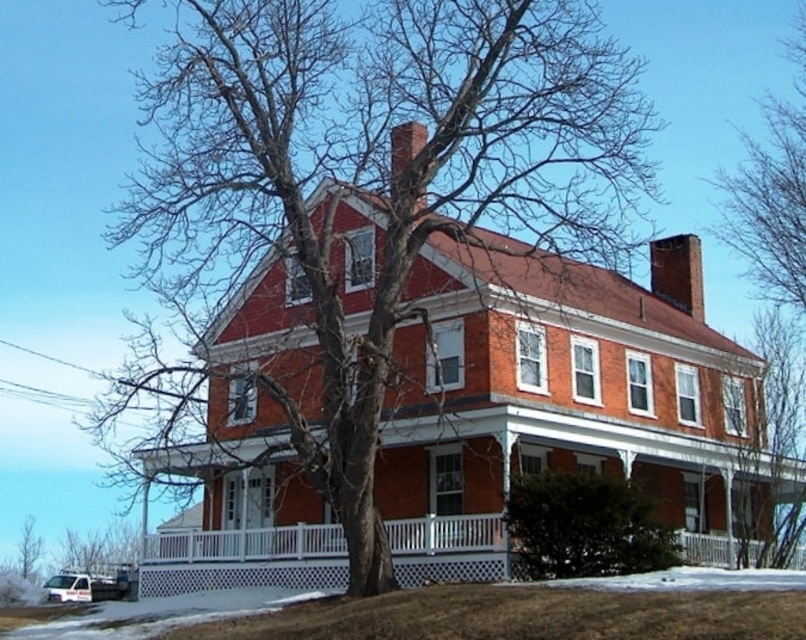
Question: Is the position of bare branches at center more distant than that of green leafy bush at lower center?

Choices:
 (A) yes
 (B) no

Answer: (B)

Question: Which point is closer to the camera taking this photo?

Choices:
 (A) (472, 150)
 (B) (657, 257)
 (C) (413, 138)

Answer: (C)

Question: Is smooth brick chimney at upper center to the left of bare branches at lower left from the viewer's perspective?

Choices:
 (A) no
 (B) yes

Answer: (A)

Question: Which point appears farthest from the camera in this image?

Choices:
 (A) (23, 554)
 (B) (640, 557)
 (C) (393, 163)

Answer: (A)

Question: Considering the relative positions of bare branches at center and bare branches at lower left in the image provided, where is bare branches at center located with respect to bare branches at lower left?

Choices:
 (A) below
 (B) above

Answer: (B)

Question: Estimate the real-world distances between objects in this image. Which object is closer to the bare wood tree at center?

Choices:
 (A) green leafy bush at lower center
 (B) bare branches at lower left

Answer: (A)